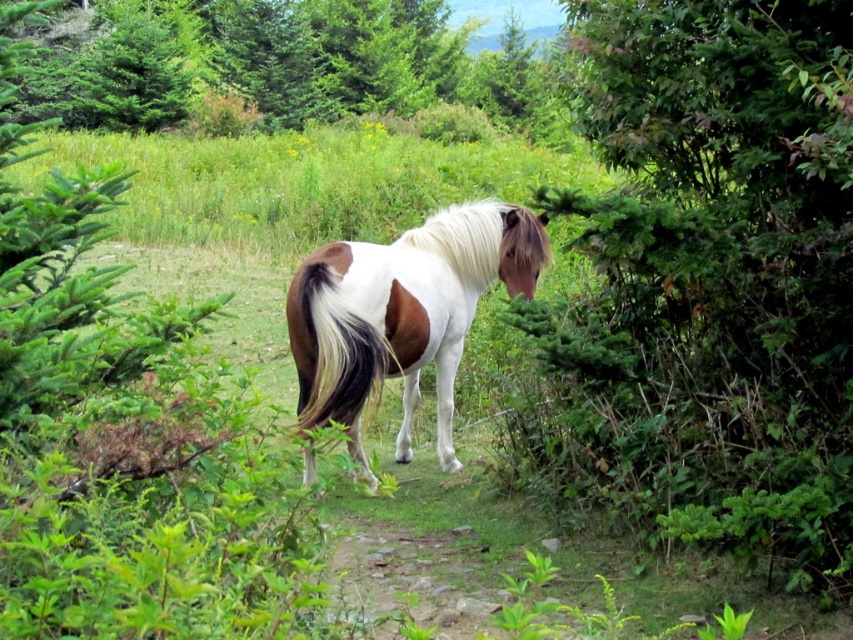
Question: Among these objects, which one is farthest from the camera?

Choices:
 (A) green leafy tree at upper center
 (B) white silky tail at center
 (C) green leafy tree at center right

Answer: (B)

Question: Considering the real-world distances, which object is farthest from the white silky mane at center?

Choices:
 (A) green leafy tree at upper center
 (B) white silky tail at center

Answer: (A)

Question: Estimate the real-world distances between objects in this image. Which object is farther from the white silky mane at center?

Choices:
 (A) white silky tail at center
 (B) green leafy tree at center right
 (C) green leafy tree at upper center

Answer: (C)

Question: Does white-brown fur horse at center appear on the left side of white silky tail at center?

Choices:
 (A) no
 (B) yes

Answer: (A)

Question: Observing the image, what is the correct spatial positioning of green leafy tree at center right in reference to white-brown fur horse at center?

Choices:
 (A) above
 (B) below

Answer: (A)

Question: Observing the image, what is the correct spatial positioning of green leafy tree at upper center in reference to white silky mane at center?

Choices:
 (A) above
 (B) below

Answer: (A)